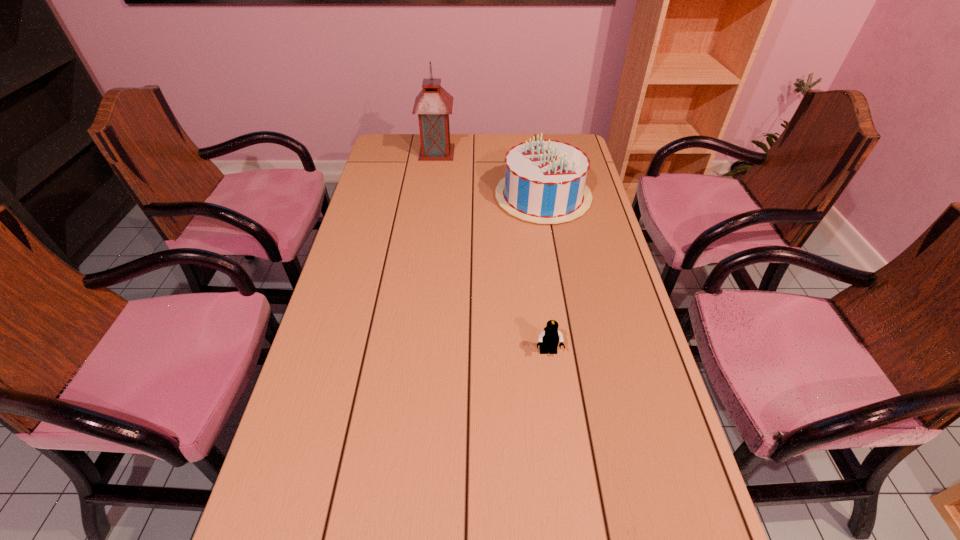
Choose which object is the nearest neighbor to the lantern. Please provide its 2D coordinates. Your answer should be formatted as a tuple, i.e. [(x, y)], where the tuple contains the x and y coordinates of a point satisfying the conditions above.

[(545, 180)]

Locate an element on the screen. The width and height of the screenshot is (960, 540). free location that satisfies the following two spatial constraints: 1. on the front side of the farthest object; 2. on the left side of the birthday cake is located at coordinates (431, 197).